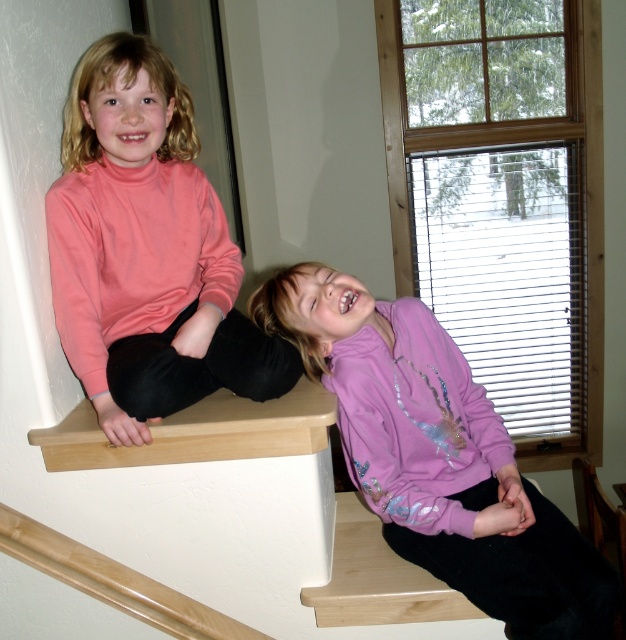
You are a parent trying to decide which child to dress in a warmer jacket for an outdoor activity. The pink turtleneck sweater at upper left and the purple fleece jacket at upper right are options. Based on their sizes in the image, which one might provide better warmth?

The pink turtleneck sweater at upper left is taller than the purple fleece jacket at upper right, suggesting it might be thicker and provide better warmth.

Looking at this image, you are a photographer trying to capture a closeup of the pink turtleneck sweater at upper left. Based on its 2D coordinates in the image, which are at point 0.392, 0.235, where should you aim your camera to ensure the sweater is centered in the frame?

You should aim your camera at the coordinates [146,250] to center the pink turtleneck sweater at upper left in the frame.